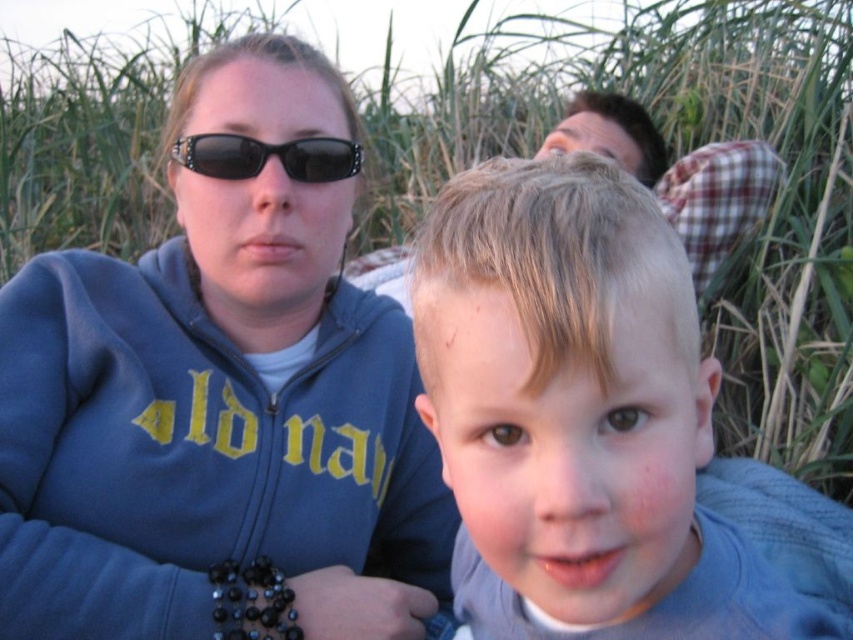
Question: Which object appears closest to the camera in this image?

Choices:
 (A) light brown hair at center
 (B) black plastic sunglasses at upper center

Answer: (A)

Question: Which point appears farthest from the camera in this image?

Choices:
 (A) (621, 218)
 (B) (71, 349)

Answer: (B)

Question: Which of the following is the closest to the observer?

Choices:
 (A) (256, 442)
 (B) (228, 156)
 (C) (515, 304)

Answer: (C)

Question: In this image, where is light brown hair at center located relative to black plastic sunglasses at upper center?

Choices:
 (A) left
 (B) right

Answer: (B)

Question: Considering the relative positions of blue fleece jacket at upper left and light brown hair at center in the image provided, where is blue fleece jacket at upper left located with respect to light brown hair at center?

Choices:
 (A) below
 (B) above

Answer: (B)

Question: Where is light brown hair at center located in relation to black plastic sunglasses at upper center in the image?

Choices:
 (A) above
 (B) below

Answer: (B)